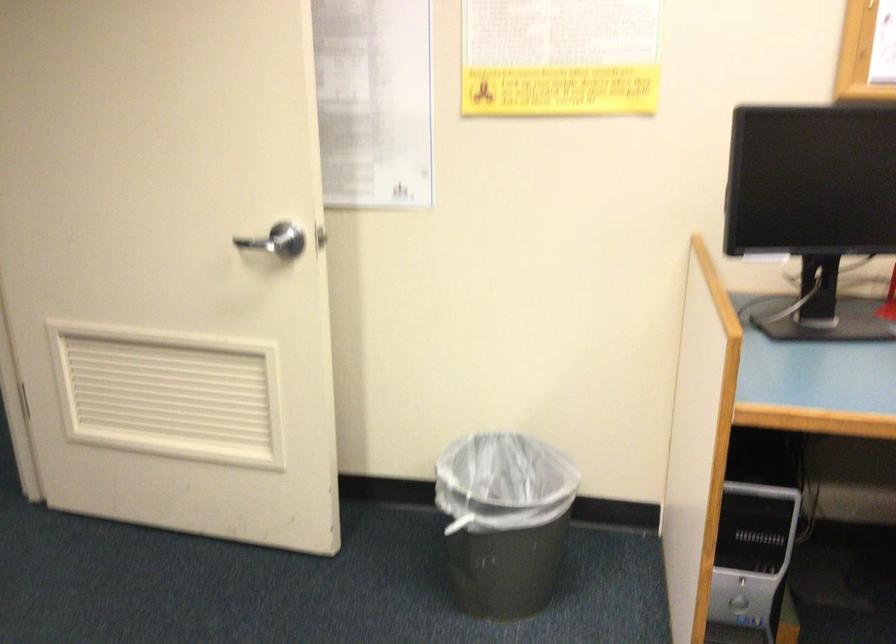
Image resolution: width=896 pixels, height=644 pixels. Identify the location of silver door handle. (286, 240).